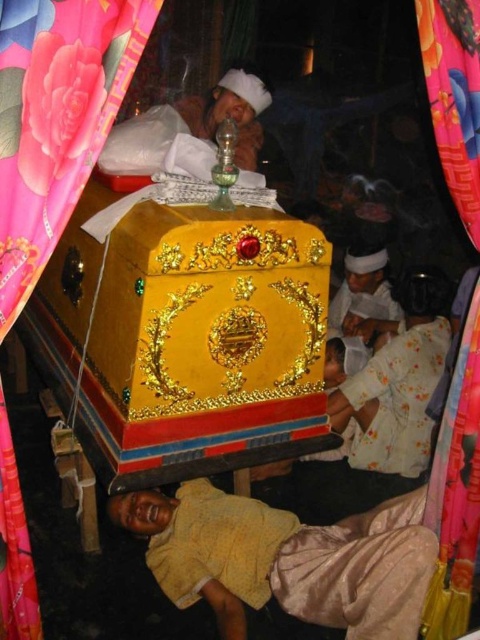
You are an event planner setting up for a ceremony. You need to ensure that the pink satin curtain at left and the pink satin curtain at upper left are arranged properly. Based on their positions, which curtain is closer to the floor?

The pink satin curtain at left is closer to the floor because it is positioned under the pink satin curtain at upper left.

Consider the image. You are an interior designer planning to replace the pink satin curtain at left and the silky pink fabric at upper left with new materials. Based on their positions, which one should be replaced first if you want to start from the lowest point?

The silky pink fabric at upper left should be replaced first because it is located below the pink satin curtain at left, making it the lower position to start with.